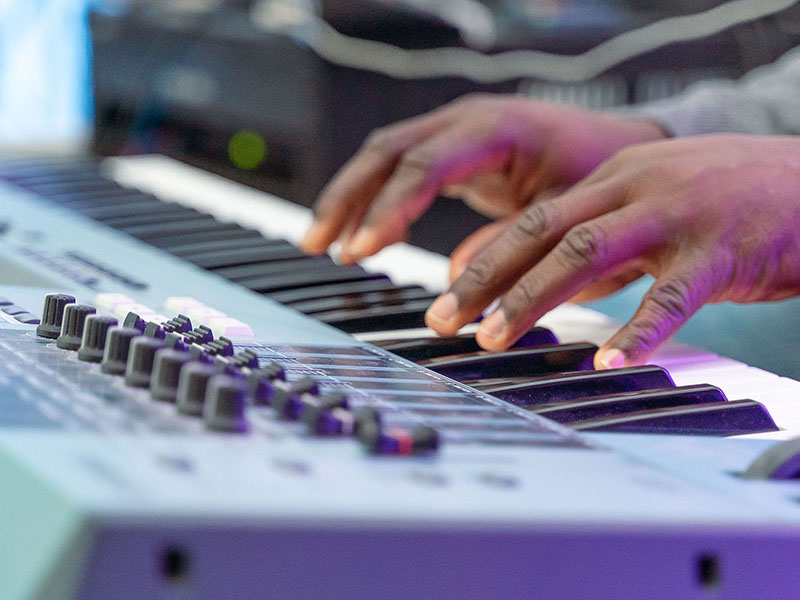
The width and height of the screenshot is (800, 600). Identify the location of black switches. (414, 438), (329, 424), (286, 400), (256, 387), (265, 367), (245, 360), (218, 343), (196, 330), (178, 319).